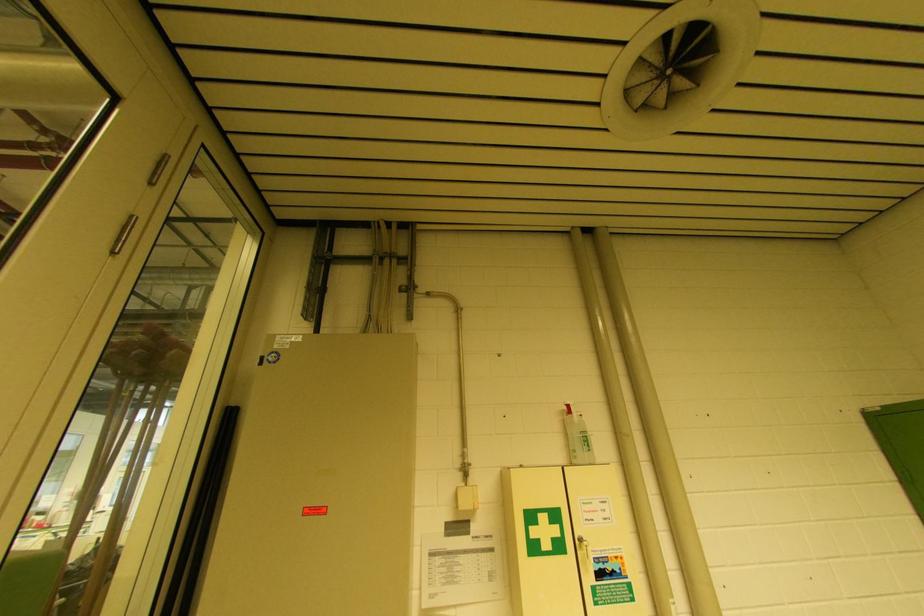
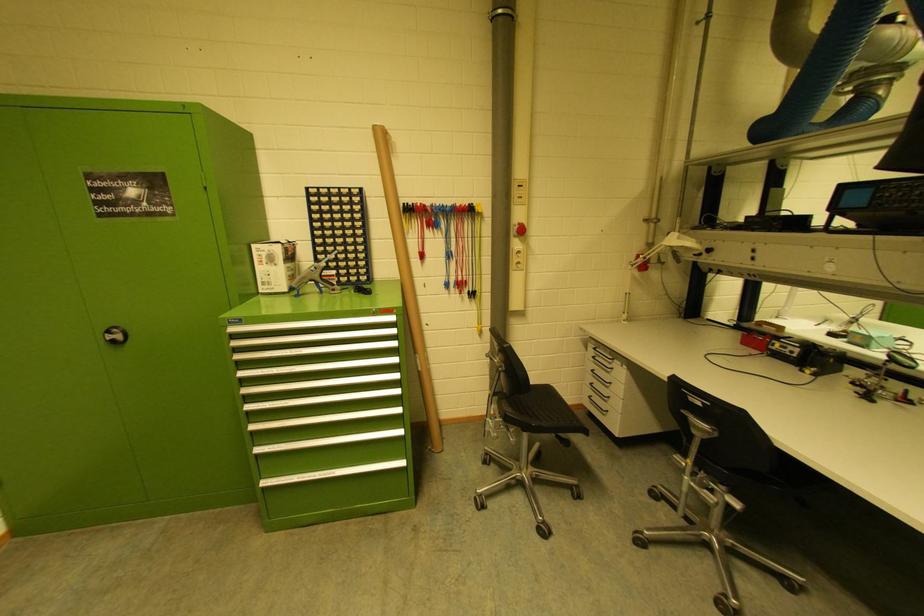
Question: The camera is either moving clockwise (left) or counter-clockwise (right) around the object. The first image is from the beginning of the video and the second image is from the end. Is the camera moving left or right when shooting the video?

Choices:
 (A) Left
 (B) Right

Answer: (A)